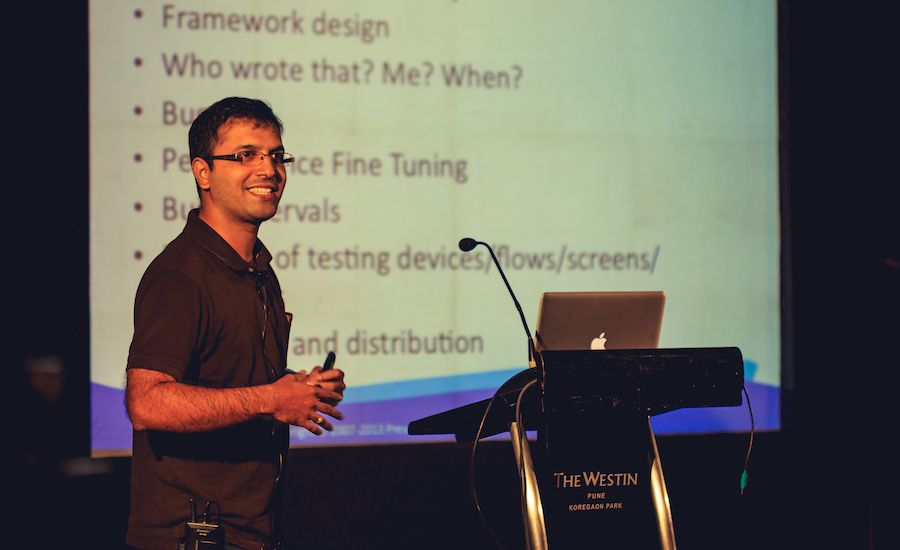
Identify the location of laptop. (626, 326).